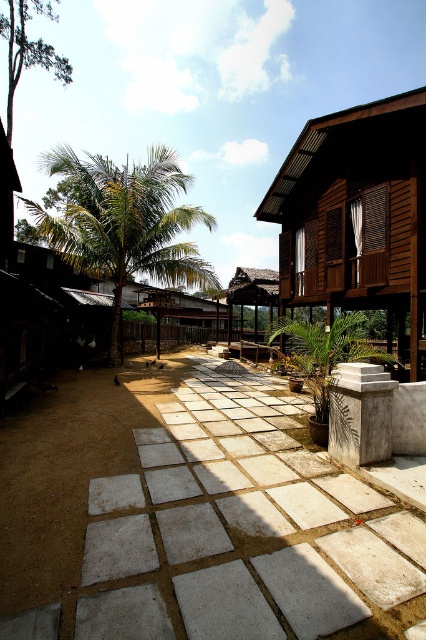
Is point (271, 189) positioned in front of point (115, 189)?

No, (271, 189) is further to viewer.

Does wooden house at right have a smaller size compared to green leafy palm tree at left?

Correct, wooden house at right occupies less space than green leafy palm tree at left.

Who is more distant from viewer, (353, 300) or (198, 260)?

Positioned behind is point (198, 260).

Image resolution: width=426 pixels, height=640 pixels. Identify the location of wooden house at right. (356, 216).

Who is positioned more to the left, green leafy palm tree at left or rustic wooden hut at center?

green leafy palm tree at left

Is green leafy palm tree at left smaller than rustic wooden hut at center?

No, green leafy palm tree at left is not smaller than rustic wooden hut at center.

Identify the location of green leafy palm tree at left. The width and height of the screenshot is (426, 640). (123, 221).

Who is more forward, (x=229, y=392) or (x=109, y=232)?

Positioned in front is point (x=229, y=392).

Which of these two, white concrete path at center or green leafy palm tree at left, stands shorter?

white concrete path at center is shorter.

This screenshot has height=640, width=426. Find the location of `white concrete path at center`. white concrete path at center is located at coordinates (193, 516).